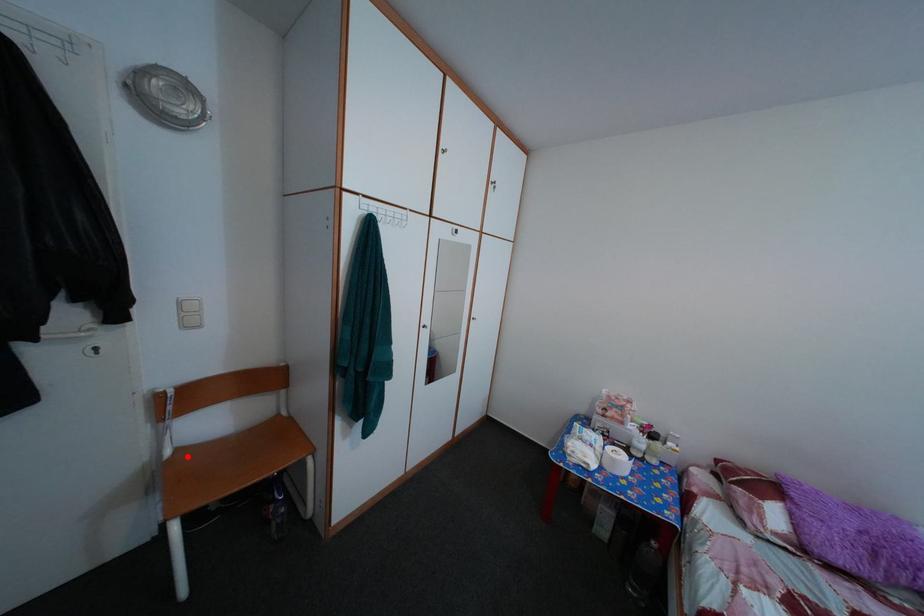
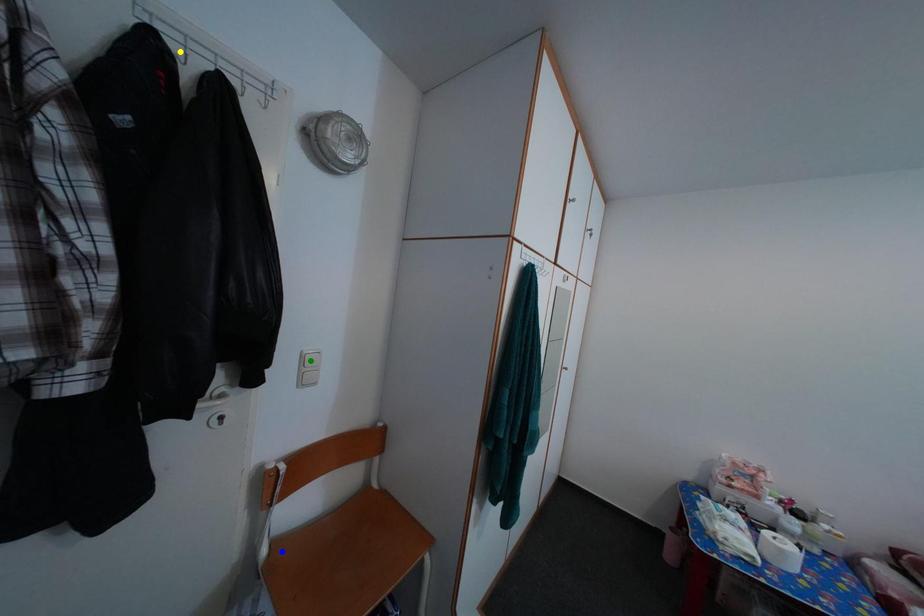
Question: I am providing you with two images of the same scene from different viewpoints. A red point is marked on the first image. You are given multiple points on the second image. Which mark in image 2 goes with the point in image 1?

Choices:
 (A) blue point
 (B) green point
 (C) yellow point

Answer: (A)